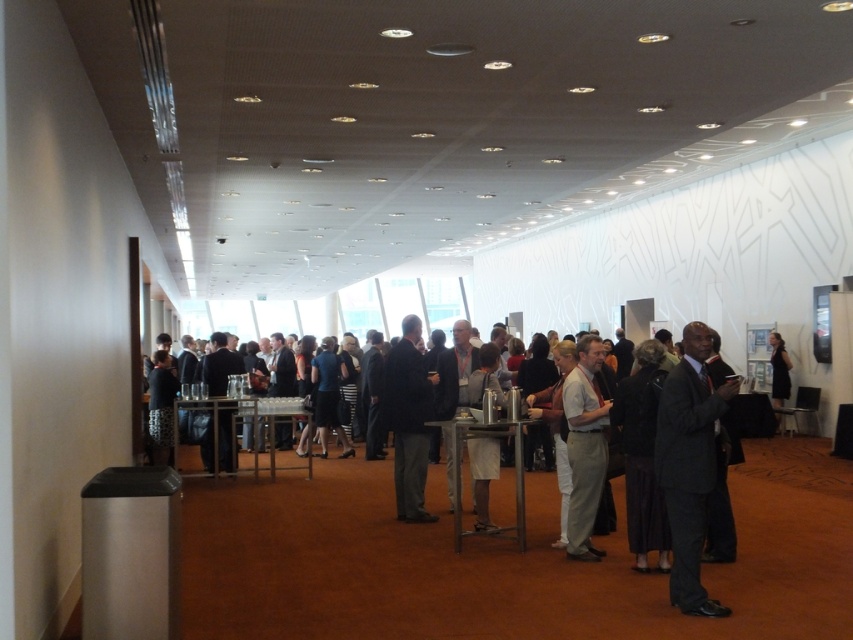
You are standing at the entrance of the conference hall and notice two people wearing suits at the center of the room. Which one is closer to you, the dark suit at center or the dark gray suit at center?

The dark suit at center is closer to the viewer than the dark gray suit at center.

You are a photographer at the event and want to capture both the dark suit at center and the light beige fabric shirt at center in a single frame. Which of the two should you focus on first to ensure they are both in clear view?

The dark suit at center is larger in size than the light beige fabric shirt at center, so focusing on the dark suit at center first will help ensure both are in clear view as it occupies more space in the frame.